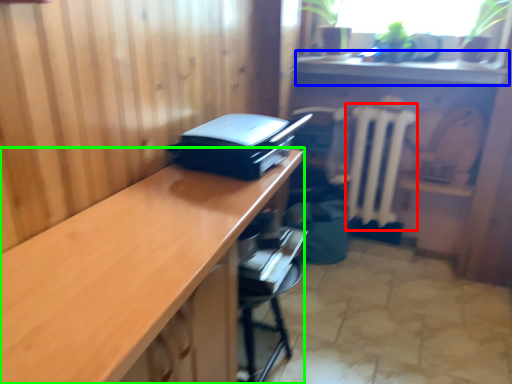
Question: Considering the real-world distances, which object is farthest from radiator (highlighted by a red box)? counter top (highlighted by a blue box) or desk (highlighted by a green box)?

Choices:
 (A) counter top
 (B) desk

Answer: (B)